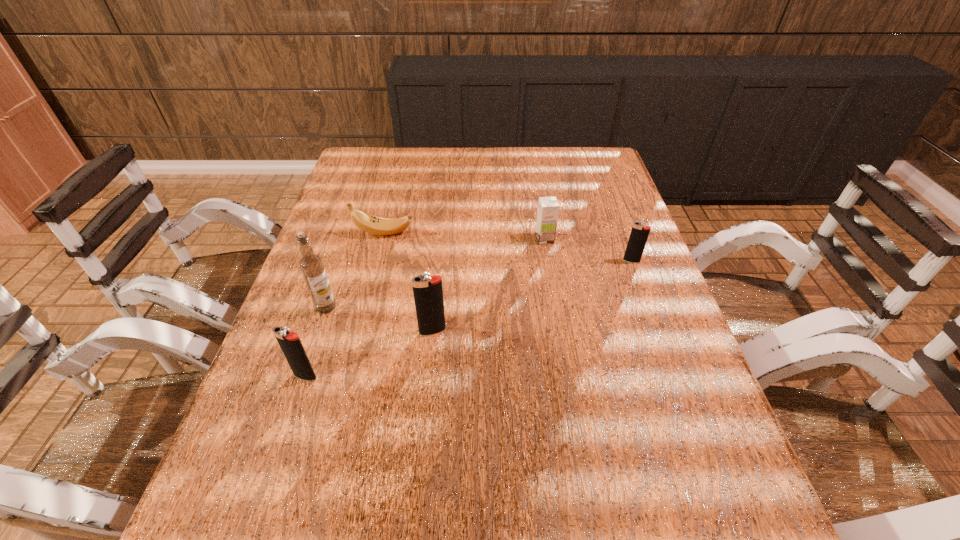
Identify the location of free location located on the right of the nearest object. This screenshot has height=540, width=960. (371, 376).

You are a GUI agent. You are given a task and a screenshot of the screen. Output one action in this format:
    pyautogui.click(x=<x>, y=<y>)
    Task: Click on the vacant space located 0.230m on the back of the second nearest object
    The height and width of the screenshot is (540, 960).
    Given the screenshot: What is the action you would take?
    pyautogui.click(x=440, y=259)

This screenshot has height=540, width=960. In order to click on blank area located 0.120m on the front of the shortest igniter in this screenshot , I will do `click(644, 296)`.

Where is `vacant area located on the back of the shortest object`? This screenshot has height=540, width=960. vacant area located on the back of the shortest object is located at coordinates (396, 186).

Find the location of a particular element. The height and width of the screenshot is (540, 960). vacant position located on the label of the third nearest object is located at coordinates (297, 395).

You are a GUI agent. You are given a task and a screenshot of the screen. Output one action in this format:
    pyautogui.click(x=<x>, y=<y>)
    Task: Click on the free space located 0.100m on the back of the chocolate milk
    The image size is (960, 540).
    Given the screenshot: What is the action you would take?
    pyautogui.click(x=540, y=213)

Where is `igniter located at the left edge`? The image size is (960, 540). igniter located at the left edge is located at coordinates (290, 343).

Find the location of a particular element. The width and height of the screenshot is (960, 540). banana situated at the left edge is located at coordinates (371, 224).

This screenshot has width=960, height=540. What are the coordinates of `vodka positioned at the left edge` in the screenshot? It's located at (311, 265).

Where is `object at the right edge`? object at the right edge is located at coordinates (639, 234).